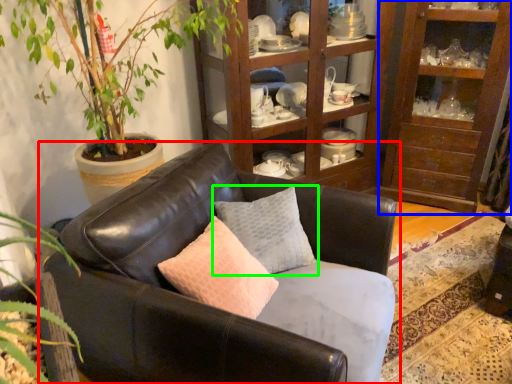
Question: Considering the real-world distances, which object is closest to studio couch (highlighted by a red box)? shelf (highlighted by a blue box) or pillow (highlighted by a green box).

Choices:
 (A) shelf
 (B) pillow

Answer: (B)